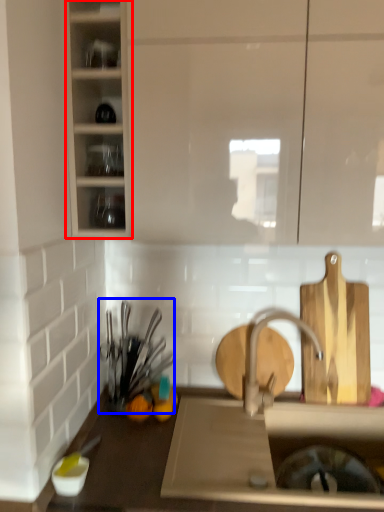
Question: Among these objects, which one is nearest to the camera, cabinetry (highlighted by a red box) or tableware (highlighted by a blue box)?

Choices:
 (A) cabinetry
 (B) tableware

Answer: (A)